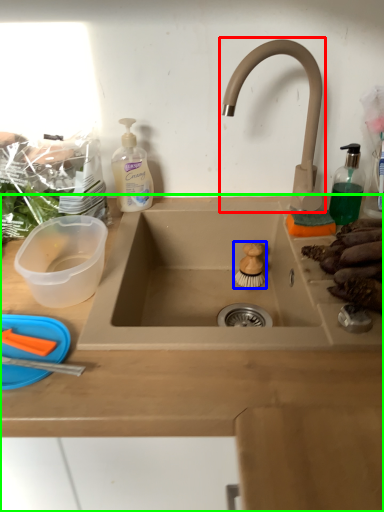
Question: Considering the real-world distances, which object is closest to tap (highlighted by a red box)? food (highlighted by a blue box) or countertop (highlighted by a green box).

Choices:
 (A) food
 (B) countertop

Answer: (A)